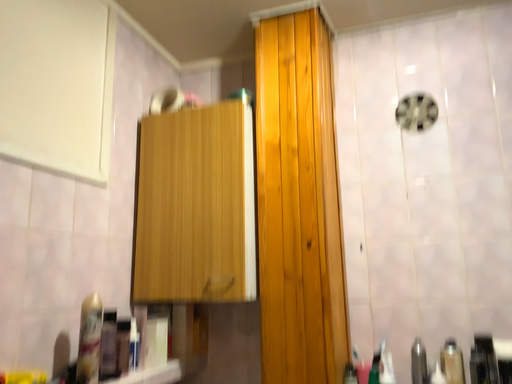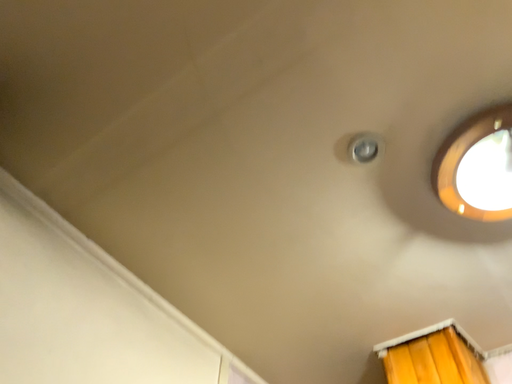
Question: Which way did the camera rotate in the video?

Choices:
 (A) rotated upward
 (B) rotated downward

Answer: (A)